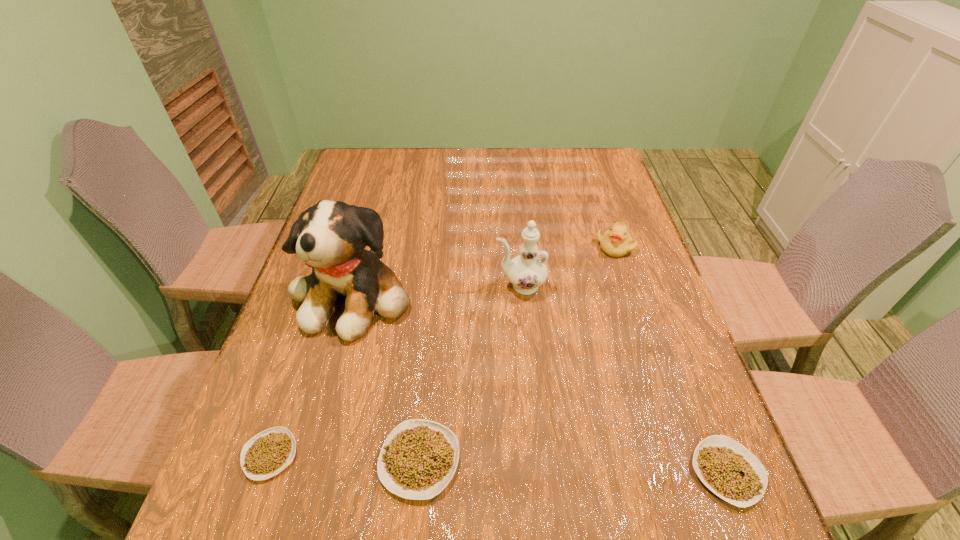
At what (x,y) coordinates should I click in order to perform the action: click on legume that is positioned at the right edge. Please return your answer as a coordinate pair (x, y). Looking at the image, I should click on (727, 468).

The image size is (960, 540). What are the coordinates of `duckling that is at the right edge` in the screenshot? It's located at (616, 242).

I want to click on object situated at the near left corner, so click(x=269, y=452).

Identify the location of object present at the near right corner. (727, 468).

In the image, there is a desktop. Where is `vacant space at the far edge`? Image resolution: width=960 pixels, height=540 pixels. vacant space at the far edge is located at coordinates (516, 184).

You are a GUI agent. You are given a task and a screenshot of the screen. Output one action in this format:
    pyautogui.click(x=<x>, y=<y>)
    Task: Click on the free space at the near edge of the desktop
    This screenshot has width=960, height=540.
    Given the screenshot: What is the action you would take?
    pyautogui.click(x=325, y=434)

Locate an element on the screen. This screenshot has height=540, width=960. vacant space at the right edge of the desktop is located at coordinates pos(619,221).

The image size is (960, 540). Find the location of `vacant area at the far left corner`. vacant area at the far left corner is located at coordinates (367, 162).

Locate an element on the screen. The image size is (960, 540). vacant space at the far right corner is located at coordinates (587, 181).

The image size is (960, 540). In order to click on blank region between the shortest legume and the tallest legume in this screenshot , I will do `click(345, 457)`.